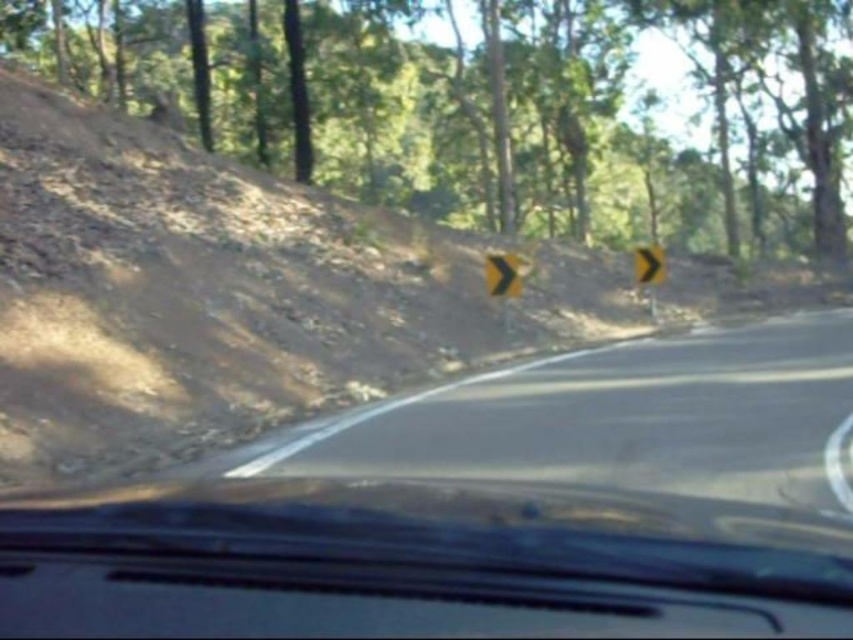
Is point (560, 625) positioned before point (662, 260)?

Yes.

What do you see at coordinates (396, 566) in the screenshot? I see `transparent plastic windshield at center` at bounding box center [396, 566].

This screenshot has height=640, width=853. Identify the location of transparent plastic windshield at center. click(x=396, y=566).

The height and width of the screenshot is (640, 853). I want to click on transparent plastic windshield at center, so click(x=396, y=566).

Does brown dirt hill at upper left appear on the right side of black asphalt road at center?

Correct, you'll find brown dirt hill at upper left to the right of black asphalt road at center.

Is brown dirt hill at upper left wider than black asphalt road at center?

Correct, the width of brown dirt hill at upper left exceeds that of black asphalt road at center.

Which is in front, point (583, 240) or point (624, 474)?

Point (624, 474) is in front.

Where is `brown dirt hill at upper left`? brown dirt hill at upper left is located at coordinates (490, 106).

Describe the element at coordinates (396, 566) in the screenshot. I see `transparent plastic windshield at center` at that location.

Between transparent plastic windshield at center and black asphalt road at center, which one appears on the right side from the viewer's perspective?

black asphalt road at center

Is point (357, 632) in front of point (738, 358)?

Yes, point (357, 632) is closer to viewer.

Identify the location of transparent plastic windshield at center. The width and height of the screenshot is (853, 640). (396, 566).